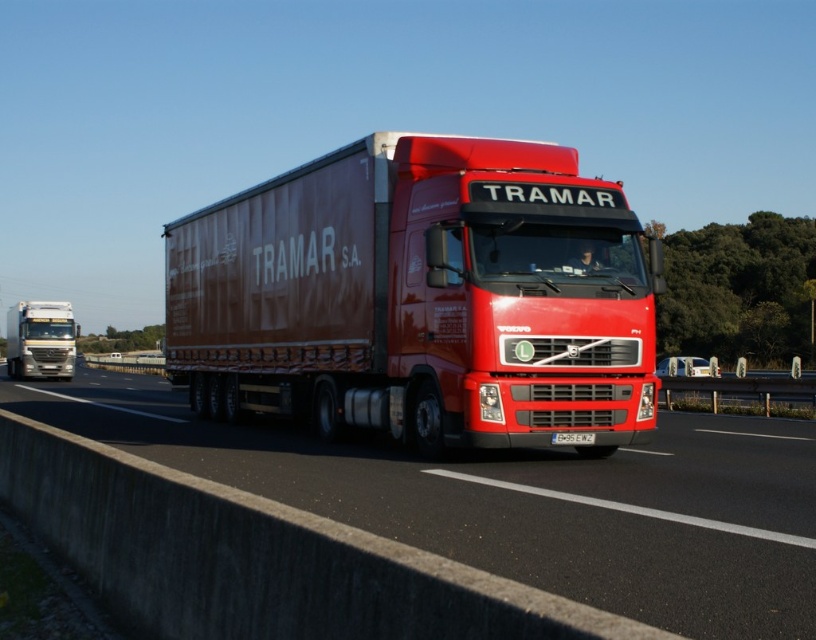
Does metallic red truck at center have a greater height compared to red matte truck at center?

Yes, metallic red truck at center is taller than red matte truck at center.

Where is `metallic red truck at center`? Image resolution: width=816 pixels, height=640 pixels. metallic red truck at center is located at coordinates (420, 298).

The width and height of the screenshot is (816, 640). I want to click on metallic red truck at center, so click(x=420, y=298).

Does metallic silver truck at left have a greater width compared to white plastic license plate at center?

Yes.

Does metallic silver truck at left have a larger size compared to white plastic license plate at center?

Indeed, metallic silver truck at left has a larger size compared to white plastic license plate at center.

Who is more forward, (69, 304) or (588, 435)?

Point (588, 435) is in front.

Find the location of a particular element. This screenshot has height=640, width=816. metallic silver truck at left is located at coordinates (40, 339).

Which is behind, point (602, 474) or point (29, 371)?

Point (29, 371)

Which is more to the right, red matte truck at center or metallic silver truck at left?

red matte truck at center is more to the right.

This screenshot has height=640, width=816. What are the coordinates of `red matte truck at center` in the screenshot? It's located at (521, 500).

Where is `red matte truck at center`? The width and height of the screenshot is (816, 640). red matte truck at center is located at coordinates (521, 500).